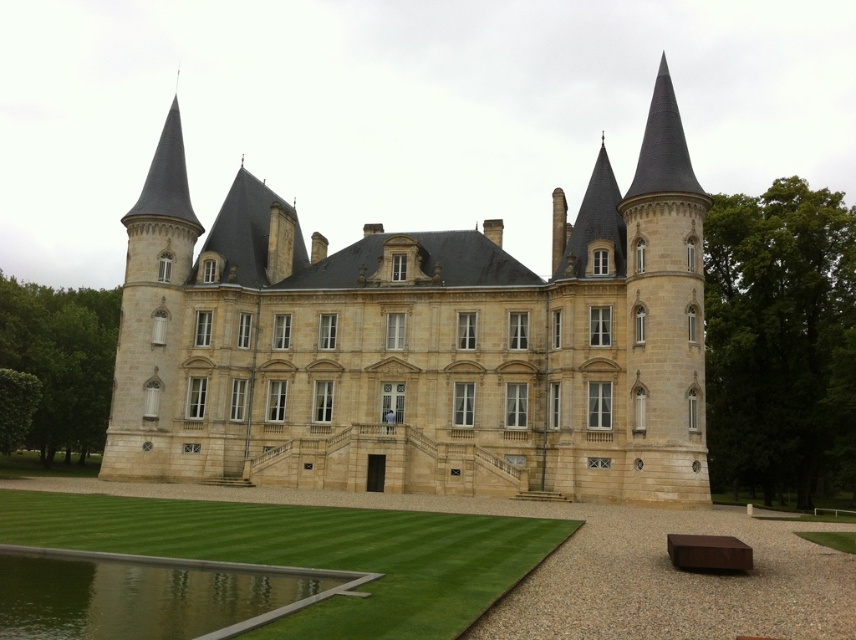
Question: Observing the image, what is the correct spatial positioning of green grass lawn at lower center in reference to green reflective water at lower center?

Choices:
 (A) below
 (B) above

Answer: (A)

Question: Which point is farther to the camera?

Choices:
 (A) (235, 291)
 (B) (366, 624)
 (C) (3, 625)

Answer: (A)

Question: Which of the following is the farthest from the observer?

Choices:
 (A) (378, 518)
 (B) (67, 605)
 (C) (687, 268)

Answer: (C)

Question: Which point is closer to the camera taking this photo?

Choices:
 (A) (337, 481)
 (B) (42, 625)

Answer: (B)

Question: Is green grass lawn at lower center wider than green reflective water at lower center?

Choices:
 (A) no
 (B) yes

Answer: (B)

Question: Observing the image, what is the correct spatial positioning of green grass lawn at lower center in reference to green reflective water at lower center?

Choices:
 (A) below
 (B) above

Answer: (A)